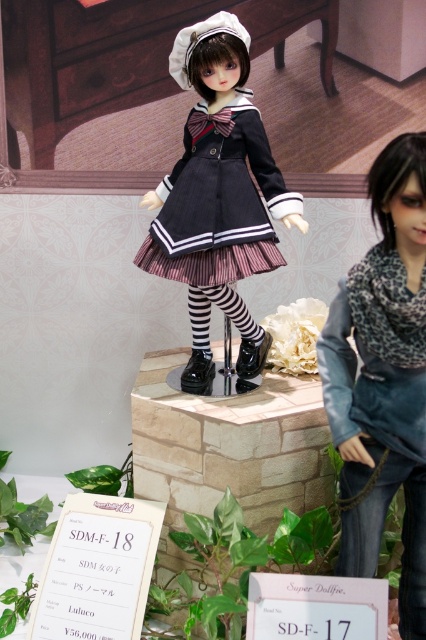
Question: Which object appears closest to the camera in this image?

Choices:
 (A) satin-like black dress at center
 (B) matte black dress at center
 (C) leopard print scarf at right

Answer: (C)

Question: Which object is the closest to the satin-like black dress at center?

Choices:
 (A) matte black dress at center
 (B) leopard print scarf at right

Answer: (A)

Question: Does leopard print scarf at right have a greater width compared to satin-like black dress at center?

Choices:
 (A) yes
 (B) no

Answer: (B)

Question: Can you confirm if leopard print scarf at right is positioned below satin-like black dress at center?

Choices:
 (A) yes
 (B) no

Answer: (A)

Question: Which of these objects is positioned farthest from the satin-like black dress at center?

Choices:
 (A) leopard print scarf at right
 (B) matte black dress at center

Answer: (A)

Question: Does matte black dress at center appear over satin-like black dress at center?

Choices:
 (A) no
 (B) yes

Answer: (A)